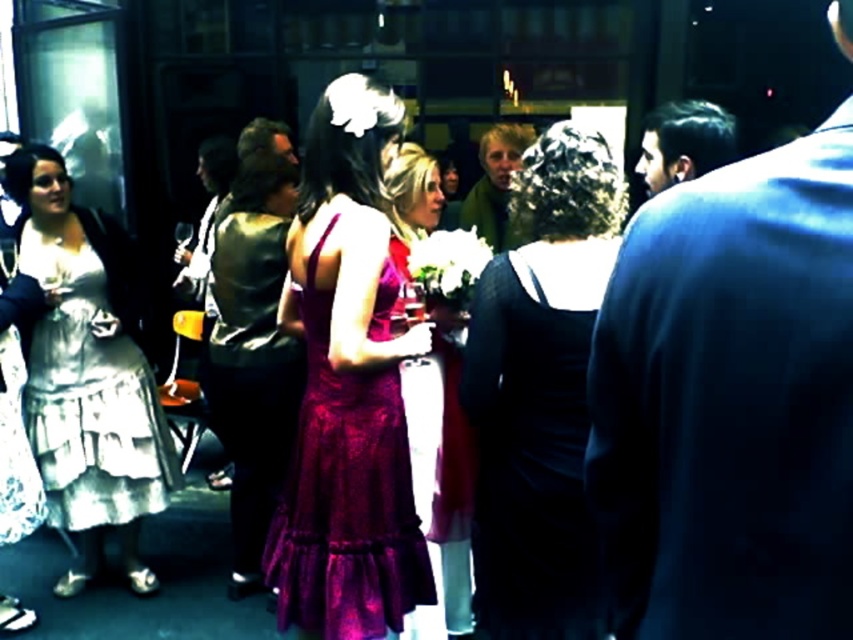
Can you confirm if dark blue suit at right is thinner than black textured dress at center?

Correct, dark blue suit at right's width is less than black textured dress at center's.

Describe the element at coordinates (730, 403) in the screenshot. Image resolution: width=853 pixels, height=640 pixels. I see `dark blue suit at right` at that location.

Between point (820, 161) and point (576, 314), which one is positioned behind?

The point (576, 314) is more distant.

Where is `dark blue suit at right`? dark blue suit at right is located at coordinates (730, 403).

Is point (349, 428) more distant than point (498, 184)?

No, (349, 428) is in front of (498, 184).

Is point (392, 602) closer to camera compared to point (508, 124)?

Yes, it is.

Does point (306, 625) come farther from viewer compared to point (492, 189)?

No, (306, 625) is in front of (492, 189).

Locate an element on the screen. The height and width of the screenshot is (640, 853). lace-like purple dress at center is located at coordinates (346, 497).

Which is in front, point (469, 602) or point (497, 237)?

Point (469, 602) is more forward.

Is purple lace dress at center positioned in front of green fuzzy sweater at center?

Yes, it is.

You are a GUI agent. You are given a task and a screenshot of the screen. Output one action in this format:
    pyautogui.click(x=<x>, y=<y>)
    Task: Click on the purple lace dress at center
    
    Given the screenshot: What is the action you would take?
    pyautogui.click(x=440, y=481)